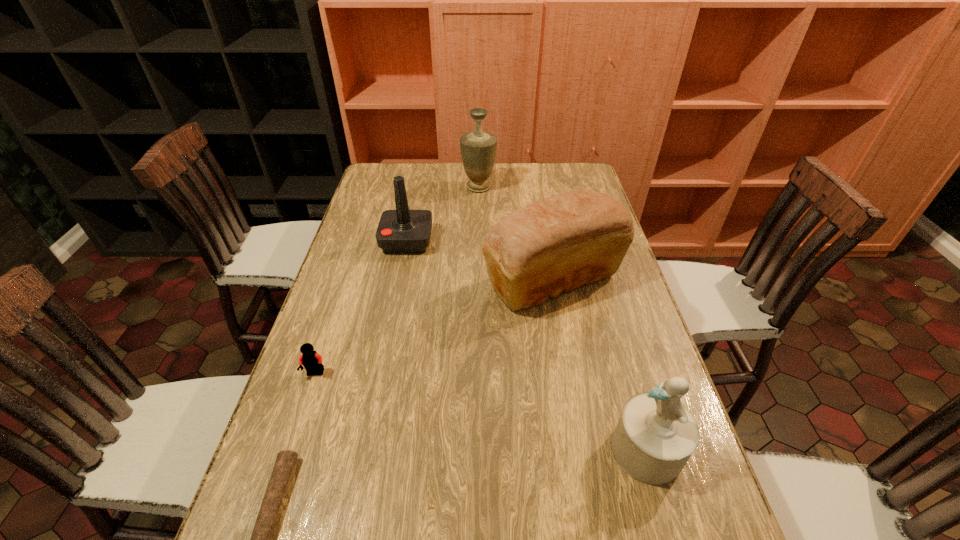
This screenshot has width=960, height=540. I want to click on urn, so click(478, 148).

Where is `bread`? The width and height of the screenshot is (960, 540). bread is located at coordinates (560, 243).

I want to click on figurine, so (656, 435).

The height and width of the screenshot is (540, 960). I want to click on the fourth object from right to left, so click(x=402, y=231).

Find the location of a particular element. This screenshot has height=540, width=960. Lego is located at coordinates (310, 359).

The image size is (960, 540). Identify the location of the fifth tallest object. (310, 359).

Identify the location of vacant space located on the right of the farthest object. (540, 187).

Locate an element on the screen. vacant space located 0.240m on the left of the bread is located at coordinates click(399, 280).

Locate an element on the screen. This screenshot has height=540, width=960. free space located at the beak of the figurine is located at coordinates (466, 450).

What are the coordinates of `free space located 0.140m at the beak of the figurine` in the screenshot? It's located at (543, 450).